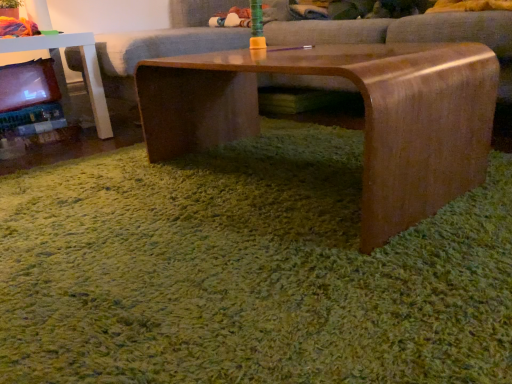
Question: Are matte plastic toy at left and green shaggy carpet at center beside each other?

Choices:
 (A) no
 (B) yes

Answer: (A)

Question: Can you confirm if matte plastic toy at left is taller than green shaggy carpet at center?

Choices:
 (A) no
 (B) yes

Answer: (B)

Question: Is matte plastic toy at left wider than green shaggy carpet at center?

Choices:
 (A) yes
 (B) no

Answer: (B)

Question: Is matte plastic toy at left oriented towards green shaggy carpet at center?

Choices:
 (A) no
 (B) yes

Answer: (B)

Question: From the image's perspective, is matte plastic toy at left located above green shaggy carpet at center?

Choices:
 (A) yes
 (B) no

Answer: (A)

Question: Is point (476, 140) closer or farther from the camera than point (330, 39)?

Choices:
 (A) farther
 (B) closer

Answer: (B)

Question: From the image's perspective, is shiny brown wood coffee table at center above or below matte brown couch at center?

Choices:
 (A) above
 (B) below

Answer: (B)

Question: Considering their positions, is shiny brown wood coffee table at center located in front of or behind matte brown couch at center?

Choices:
 (A) front
 (B) behind

Answer: (A)

Question: Would you say shiny brown wood coffee table at center is inside or outside matte brown couch at center?

Choices:
 (A) inside
 (B) outside

Answer: (B)

Question: Does point (18, 51) appear closer or farther from the camera than point (364, 165)?

Choices:
 (A) farther
 (B) closer

Answer: (A)

Question: From the image's perspective, is matte plastic toy at left positioned above or below shiny brown wood coffee table at center?

Choices:
 (A) above
 (B) below

Answer: (A)

Question: Is matte plastic toy at left in front of or behind shiny brown wood coffee table at center in the image?

Choices:
 (A) front
 (B) behind

Answer: (B)

Question: From a real-world perspective, is matte plastic toy at left above or below shiny brown wood coffee table at center?

Choices:
 (A) below
 (B) above

Answer: (B)

Question: From a real-world perspective, is green shaggy carpet at center physically located above or below shiny brown wood coffee table at center?

Choices:
 (A) below
 (B) above

Answer: (A)

Question: Is green shaggy carpet at center to the left or to the right of shiny brown wood coffee table at center in the image?

Choices:
 (A) left
 (B) right

Answer: (A)